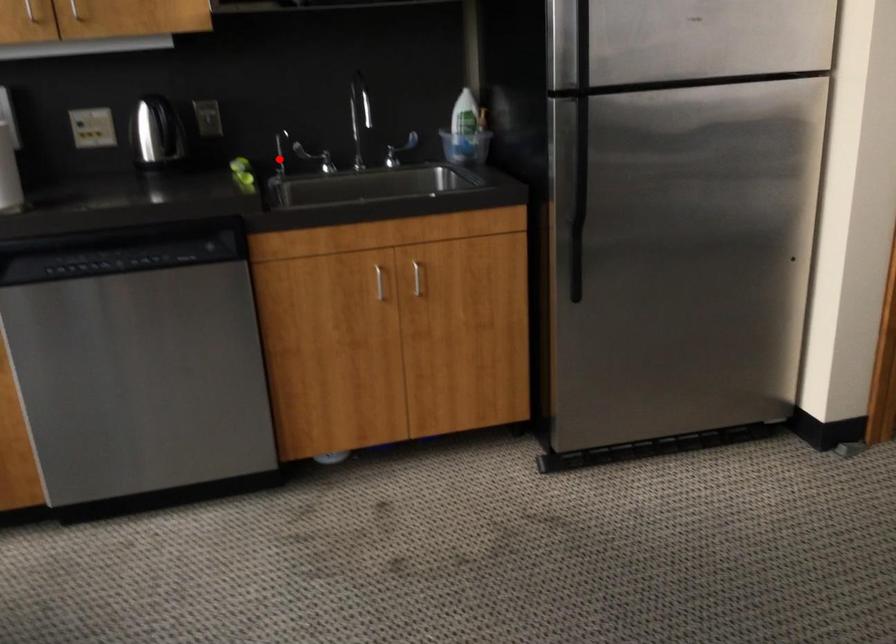
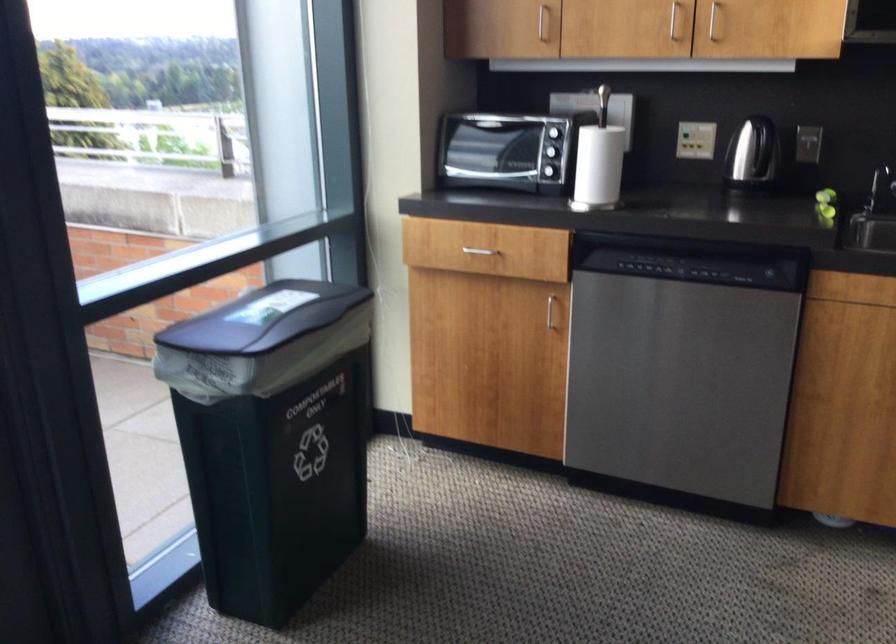
Find the pixel in the second image that matches the highlighted location in the first image.

(879, 187)